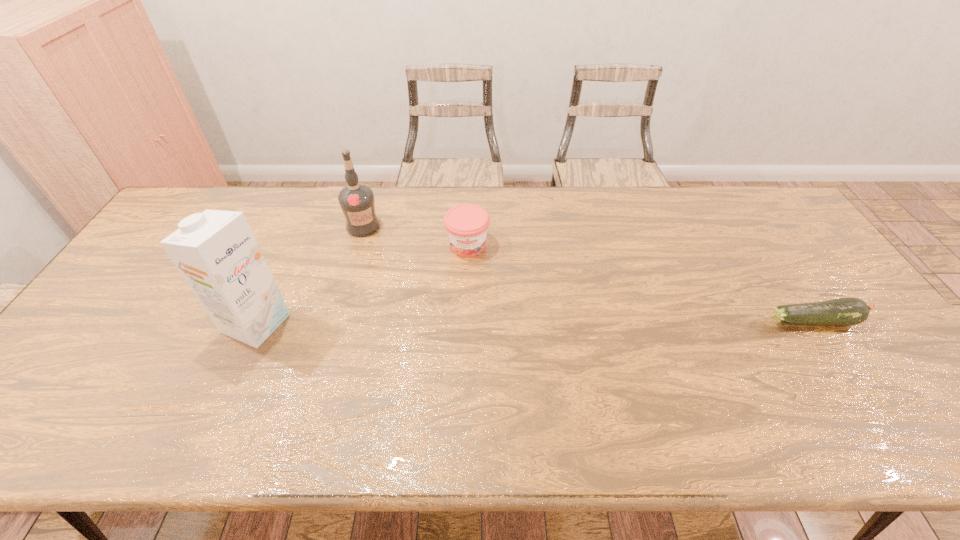
Find the location of a particular element. free point between the vodka and the rightmost object is located at coordinates (588, 273).

What are the coordinates of `free space that is in between the second tallest object and the second shortest object` in the screenshot? It's located at (416, 236).

What are the coordinates of `the closest object to the vodka` in the screenshot? It's located at (466, 225).

Locate which object ranks in proximity to the third tallest object. Please provide its 2D coordinates. Your answer should be formatted as a tuple, i.e. [(x, y)], where the tuple contains the x and y coordinates of a point satisfying the conditions above.

[(356, 200)]

Identify the location of free space that satisfies the following two spatial constraints: 1. on the front side of the rightmost object; 2. at the blossom end of the third shortest object. (336, 321).

This screenshot has height=540, width=960. I want to click on free location that satisfies the following two spatial constraints: 1. on the back side of the leftmost object; 2. on the left side of the second tallest object, so click(x=300, y=226).

You are a GUI agent. You are given a task and a screenshot of the screen. Output one action in this format:
    pyautogui.click(x=<x>, y=<y>)
    Task: Click on the vacant space that satisfies the following two spatial constraints: 1. on the back side of the tallest object; 2. on the right side of the third object from right to left
    The image size is (960, 540).
    Given the screenshot: What is the action you would take?
    point(300,226)